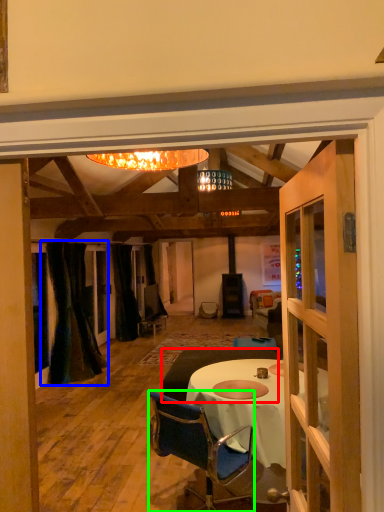
Question: Considering the real-world distances, which object is closest to studio couch (highlighted by a red box)? curtain (highlighted by a blue box) or chair (highlighted by a green box).

Choices:
 (A) curtain
 (B) chair

Answer: (B)